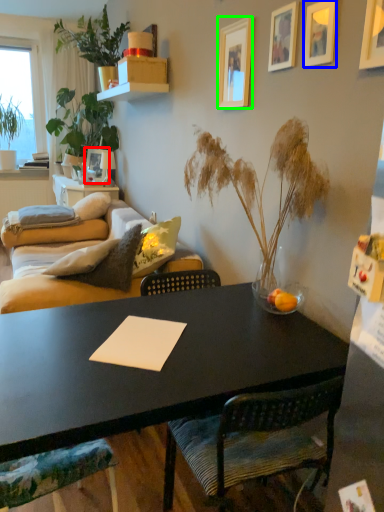
Question: Estimate the real-world distances between objects in this image. Which object is closer to picture frame (highlighted by a red box), picture frame (highlighted by a blue box) or picture frame (highlighted by a green box)?

Choices:
 (A) picture frame
 (B) picture frame

Answer: (B)